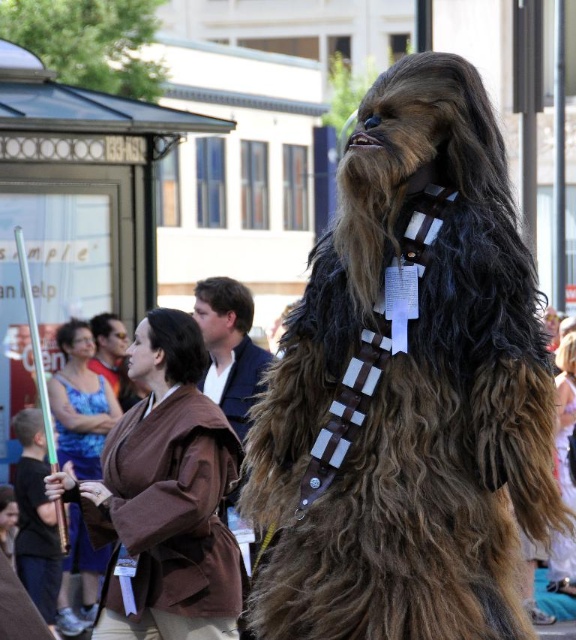
Question: Which object appears closest to the camera in this image?

Choices:
 (A) brown fabric dress at center
 (B) brown fabric shirt at center
 (C) brown fuzzy fur at center

Answer: (A)

Question: Which point is farther from the camera taking this photo?

Choices:
 (A) (175, 628)
 (B) (73, 410)
 (C) (399, 412)

Answer: (B)

Question: Is brown fabric robe at center smaller than blue satin dress at center?

Choices:
 (A) yes
 (B) no

Answer: (A)

Question: From the image, what is the correct spatial relationship of brown fabric robe at center in relation to brown fabric dress at center?

Choices:
 (A) below
 (B) above

Answer: (B)

Question: In this image, where is blue satin dress at center located relative to brown fabric dress at center?

Choices:
 (A) above
 (B) below

Answer: (B)

Question: Which of the following is the farthest from the observer?

Choices:
 (A) (98, 548)
 (B) (230, 422)

Answer: (B)